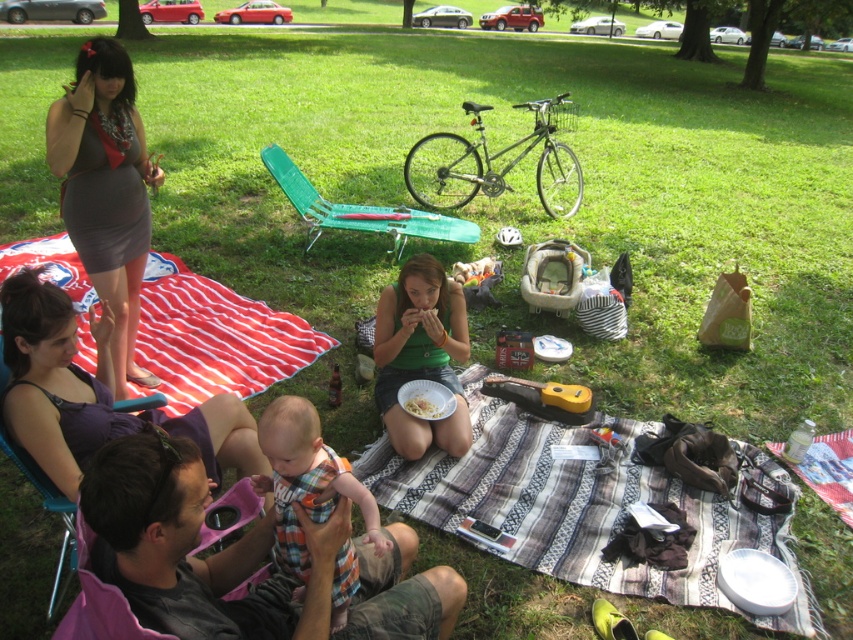
You are planning to place a small toy on the picnic blanket. Given the current arrangement, can the toy be placed on the red striped picnic blanket at upper left without covering the plaid fabric baby at center?

The red striped picnic blanket at upper left is positioned over the plaid fabric baby at center, so placing the toy on the blanket would also be over the baby, thus covering it. Choose another spot.

You are a photographer at the picnic scene and want to capture a photo of the gray fabric shirt at center and the white matte paper plate at center. Which object is located to the left of the other?

The gray fabric shirt at center is positioned on the left side of white matte paper plate at center.